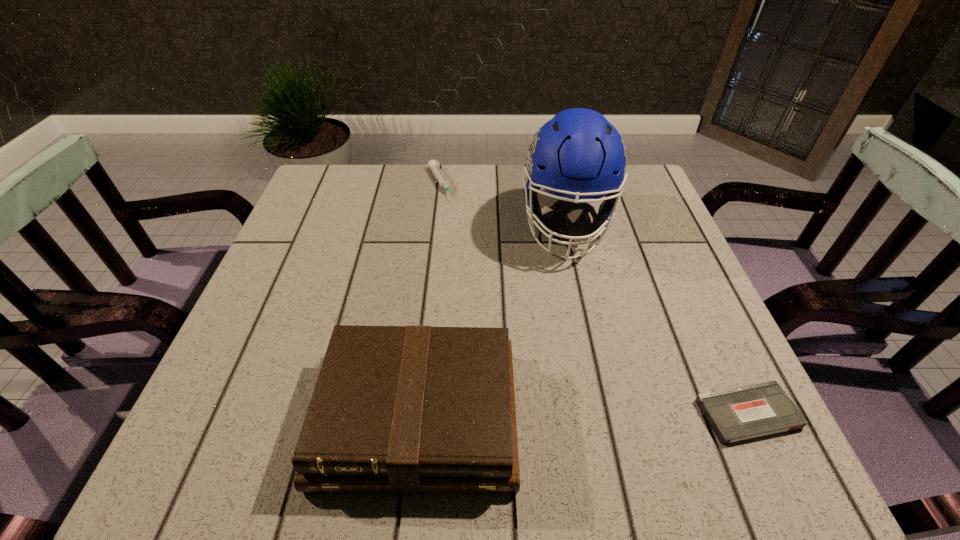
The width and height of the screenshot is (960, 540). Identify the location of free location located 0.120m at the needle end of the third tallest object. (460, 230).

I want to click on vacant position located at the needle end of the third tallest object, so click(x=491, y=285).

Find the location of a particular element. vacant space situated at the needle end of the third tallest object is located at coordinates pyautogui.click(x=453, y=218).

Locate an element on the screen. This screenshot has width=960, height=540. football helmet that is positioned at the far edge is located at coordinates (578, 154).

Identify the location of syringe present at the far edge. (433, 165).

The height and width of the screenshot is (540, 960). I want to click on Bible present at the near edge, so click(x=404, y=409).

Where is `videotape that is positioned at the near edge`? This screenshot has width=960, height=540. videotape that is positioned at the near edge is located at coordinates (738, 414).

I want to click on videotape present at the right edge, so coord(738,414).

The image size is (960, 540). What are the coordinates of `football helmet located at the right edge` in the screenshot? It's located at (578, 154).

Locate an element on the screen. This screenshot has height=540, width=960. object that is at the far right corner is located at coordinates (578, 154).